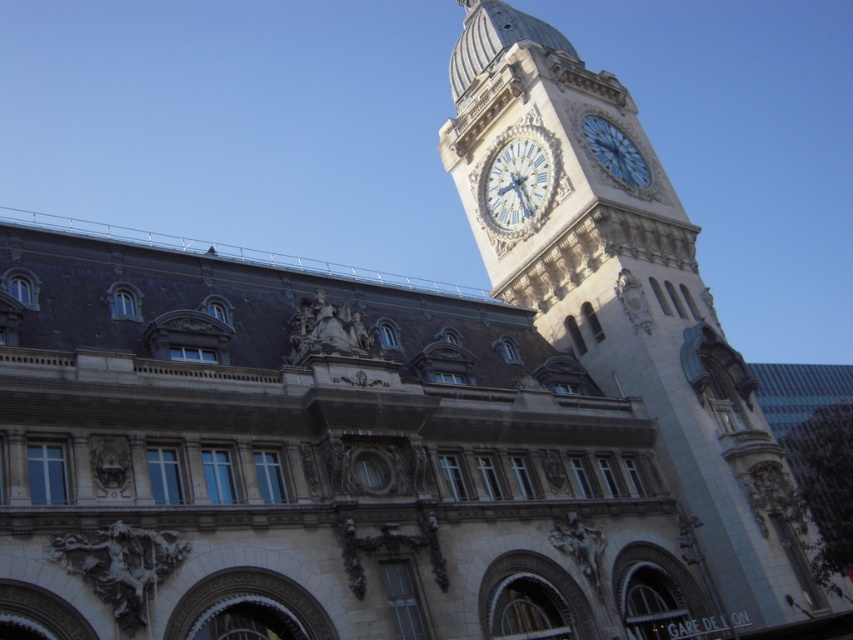
Is stone clock tower at upper right taller than blue glass clock at upper right?

Yes.

Based on the photo, which is below, stone clock tower at upper right or blue glass clock at upper right?

stone clock tower at upper right

Is point (708, 326) farther from camera compared to point (604, 122)?

No, it is in front of (604, 122).

Find the location of a particular element. Image resolution: width=853 pixels, height=640 pixels. stone clock tower at upper right is located at coordinates (628, 300).

The height and width of the screenshot is (640, 853). What do you see at coordinates (518, 180) in the screenshot? I see `white marble clock at upper center` at bounding box center [518, 180].

Can you confirm if white marble clock at upper center is shorter than blue glass clock at upper right?

No.

This screenshot has height=640, width=853. Identify the location of white marble clock at upper center. (518, 180).

Consider the image. Measure the distance from stone clock tower at upper right to white marble clock at upper center.

stone clock tower at upper right and white marble clock at upper center are 6.90 meters apart from each other.

Between stone clock tower at upper right and white marble clock at upper center, which one is positioned lower?

stone clock tower at upper right is below.

Describe the element at coordinates (628, 300) in the screenshot. I see `stone clock tower at upper right` at that location.

Where is `stone clock tower at upper right`? This screenshot has height=640, width=853. stone clock tower at upper right is located at coordinates (628, 300).